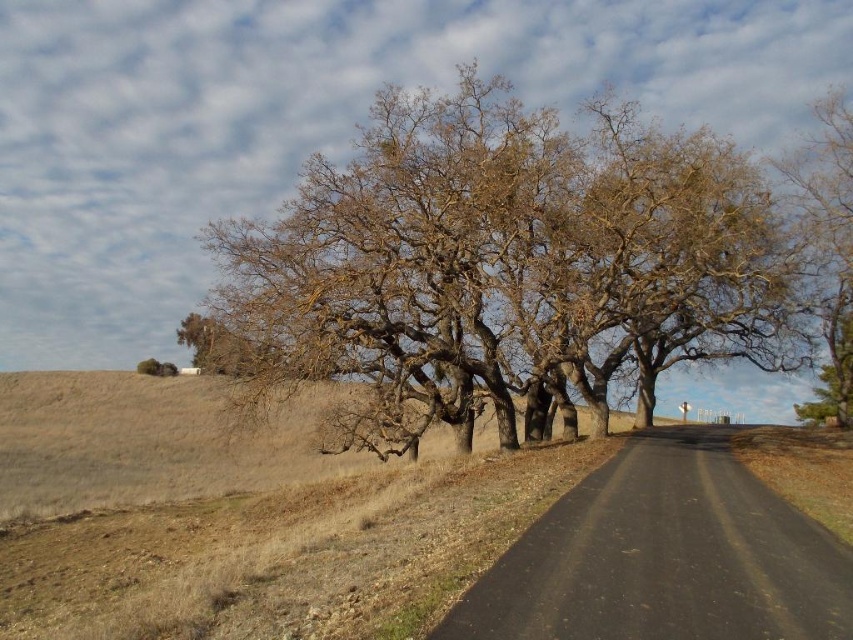
Question: Is brown grassy hill at lower left thinner than brown rough bark tree at right?

Choices:
 (A) no
 (B) yes

Answer: (A)

Question: Estimate the real-world distances between objects in this image. Which object is farther from the brown rough bark tree at right?

Choices:
 (A) brown grassy hill at lower left
 (B) brown rough bark tree at center

Answer: (A)

Question: Can you confirm if brown grassy hill at lower left is thinner than brown rough bark tree at right?

Choices:
 (A) yes
 (B) no

Answer: (B)

Question: Does brown grassy hill at lower left come behind brown rough bark tree at right?

Choices:
 (A) no
 (B) yes

Answer: (A)

Question: Which of the following is the farthest from the observer?

Choices:
 (A) brown rough bark tree at right
 (B) brown rough bark tree at center
 (C) brown grassy hill at lower left

Answer: (A)

Question: Which of the following is the farthest from the observer?

Choices:
 (A) brown rough bark tree at right
 (B) brown grassy hill at lower left
 (C) brown rough bark tree at center

Answer: (A)